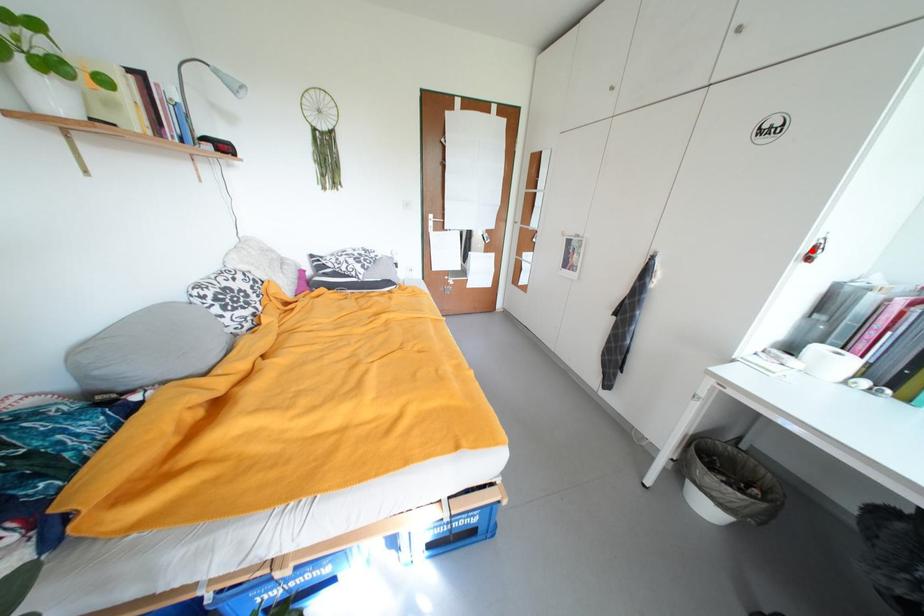
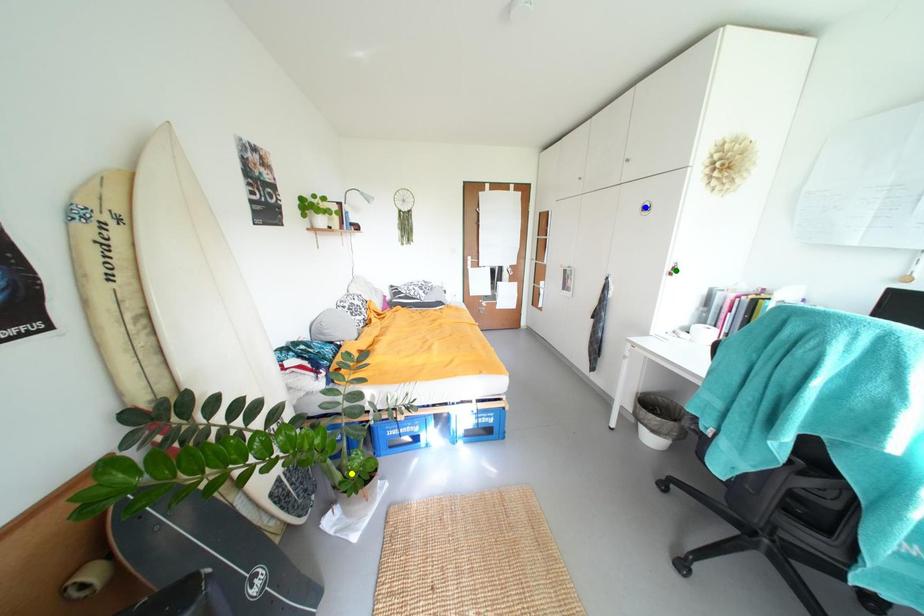
Question: I am providing you with two images of the same scene from different viewpoints. A red point is marked on the first image. You are given multiple points on the second image. In image 2, which mark is for the same physical point as the one in image 1?

Choices:
 (A) blue point
 (B) green point
 (C) yellow point

Answer: (B)